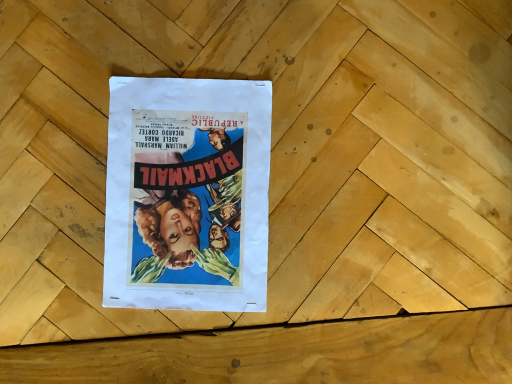
You are a GUI agent. You are given a task and a screenshot of the screen. Output one action in this format:
    pyautogui.click(x=<x>, y=<y>)
    Task: Click on the free space above matte paper poster at center (from a real-world perspective)
    The height and width of the screenshot is (384, 512).
    Given the screenshot: What is the action you would take?
    [x=186, y=185]